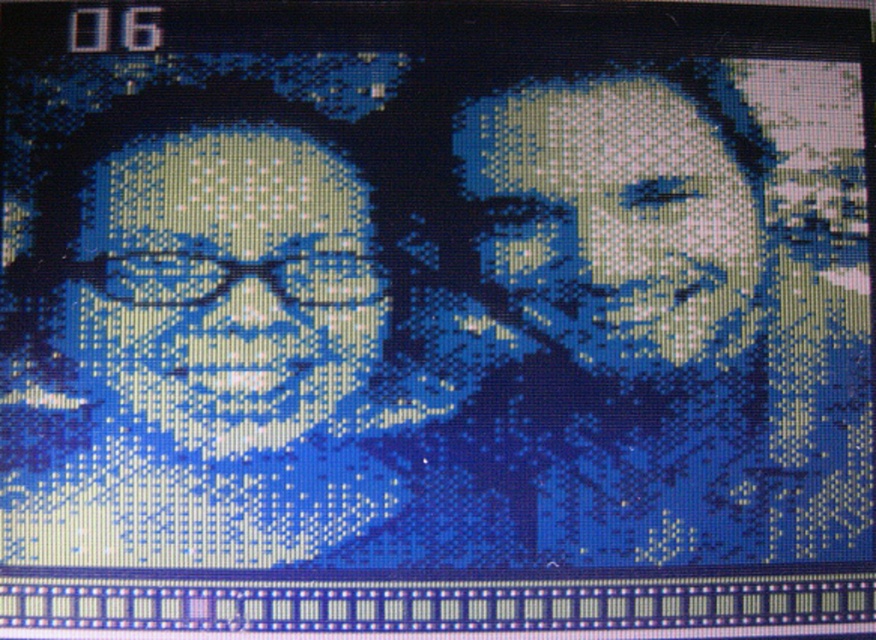
Can you confirm if matte blue face at right is positioned below matte blue face at left?

Incorrect, matte blue face at right is not positioned below matte blue face at left.

Can you confirm if matte blue face at right is smaller than matte blue face at left?

Actually, matte blue face at right might be larger than matte blue face at left.

Does point (821, 504) come in front of point (53, 163)?

Yes.

At what (x,y) coordinates should I click in order to perform the action: click on matte blue face at right. Please return your answer as a coordinate pair (x, y). Looking at the image, I should click on (696, 300).